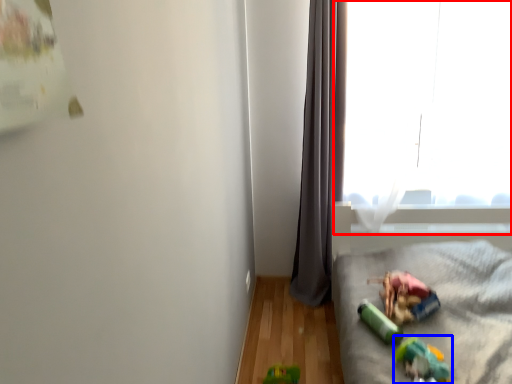
Question: Which object appears closest to the camera in this image, window (highlighted by a red box) or toy (highlighted by a blue box)?

Choices:
 (A) window
 (B) toy

Answer: (B)